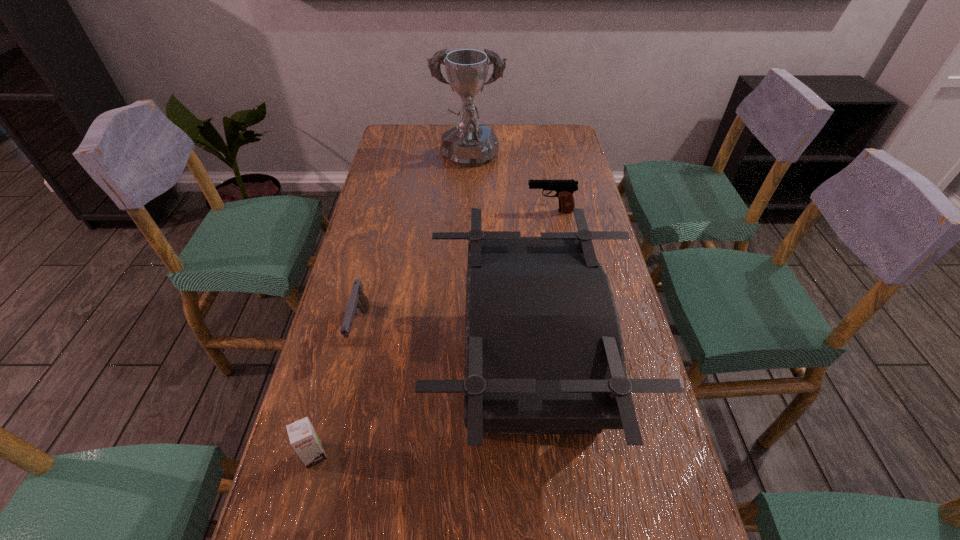
Where is `vacant point located between the chocolate milk and the second tallest object`? The height and width of the screenshot is (540, 960). vacant point located between the chocolate milk and the second tallest object is located at coordinates (421, 411).

Where is `blank region between the second farthest object and the chocolate milk`? The height and width of the screenshot is (540, 960). blank region between the second farthest object and the chocolate milk is located at coordinates (432, 333).

At what (x,y) coordinates should I click in order to perform the action: click on vacant area that lies between the nearer pistol and the farthest object. Please return your answer as a coordinate pair (x, y). The height and width of the screenshot is (540, 960). Looking at the image, I should click on (415, 244).

Locate an element on the screen. free spot between the nearer pistol and the fourth nearest object is located at coordinates (455, 269).

At what (x,y) coordinates should I click in order to perform the action: click on unoccupied area between the nearer pistol and the chocolate milk. Please return your answer as a coordinate pair (x, y). The height and width of the screenshot is (540, 960). Looking at the image, I should click on (338, 392).

Where is `object that is the second closest one to the right pistol`? object that is the second closest one to the right pistol is located at coordinates coord(544,354).

Point out which object is positioned as the second nearest to the left pistol. Please provide its 2D coordinates. Your answer should be formatted as a tuple, i.e. [(x, y)], where the tuple contains the x and y coordinates of a point satisfying the conditions above.

[(303, 437)]